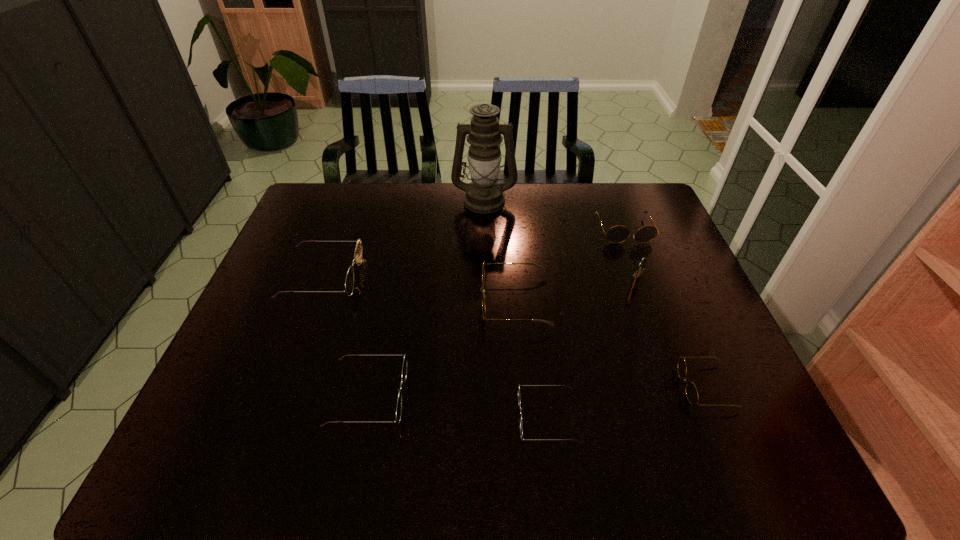
Identify the location of free area in between the seventh nearest object and the second green sunglasses from left to right. (495, 313).

Identify the location of empty location between the shortest object and the tallest object. (516, 309).

Identify the location of free spot between the nearest gray sunglasses and the leftmost green sunglasses. This screenshot has height=540, width=960. (514, 332).

Find the location of a particular element. This screenshot has width=960, height=540. free space between the biggest gray sunglasses and the padlock is located at coordinates (575, 293).

Find the location of `free spot between the smallest gray sunglasses and the fifth sunglasses from right to left`. free spot between the smallest gray sunglasses and the fifth sunglasses from right to left is located at coordinates (537, 391).

Locate an element on the screen. Image resolution: width=960 pixels, height=540 pixels. free point between the leftmost gray sunglasses and the nearest gray sunglasses is located at coordinates (611, 344).

Where is `vacant area that lies between the shortest object and the nearest gray sunglasses`? vacant area that lies between the shortest object and the nearest gray sunglasses is located at coordinates (627, 402).

Where is `vacant space that's between the seventh nearest object and the shortest sunglasses`? Image resolution: width=960 pixels, height=540 pixels. vacant space that's between the seventh nearest object and the shortest sunglasses is located at coordinates (586, 324).

The width and height of the screenshot is (960, 540). Find the location of `blank region between the second smallest gray sunglasses and the farthest green sunglasses`. blank region between the second smallest gray sunglasses and the farthest green sunglasses is located at coordinates (473, 253).

The width and height of the screenshot is (960, 540). Identify the location of vacant space in between the farthest object and the padlock. point(560,242).